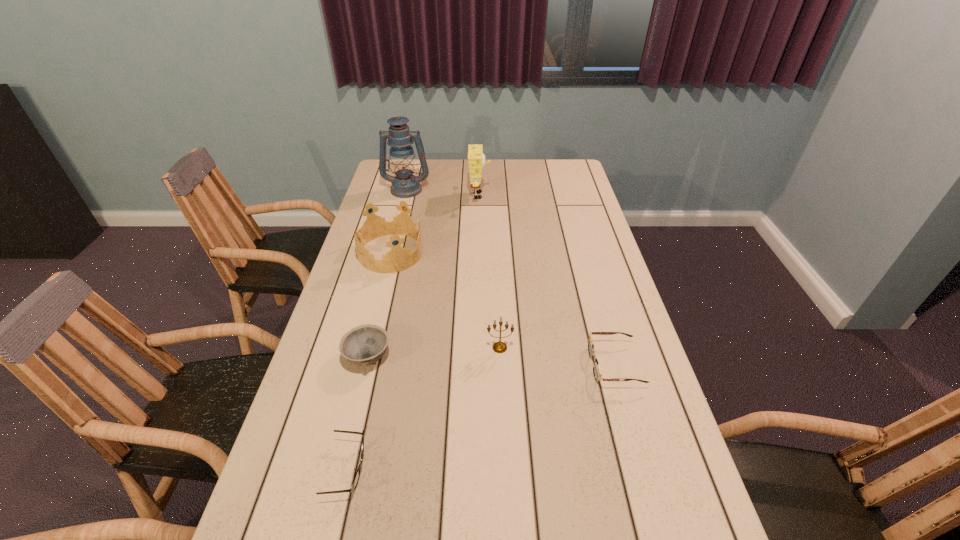
The width and height of the screenshot is (960, 540). Find the location of `object that stands as the sixth closest to the second tallest object`. object that stands as the sixth closest to the second tallest object is located at coordinates (356, 479).

The image size is (960, 540). I want to click on vacant space that satisfies the following two spatial constraints: 1. on the front-facing side of the tiara; 2. on the back side of the candelabrum, so click(x=367, y=348).

What are the coordinates of `free space that satisfies the following two spatial constraints: 1. on the front-facing side of the third shortest object; 2. on the right side of the tiara` in the screenshot? It's located at (364, 357).

Where is `free spot that satisfies the following two spatial constraints: 1. on the front-facing side of the bowl; 2. on the right side of the tallest object`? Image resolution: width=960 pixels, height=540 pixels. free spot that satisfies the following two spatial constraints: 1. on the front-facing side of the bowl; 2. on the right side of the tallest object is located at coordinates (365, 357).

Find the location of a particular element. The image size is (960, 540). blank area in the image that satisfies the following two spatial constraints: 1. on the front-facing side of the tallest object; 2. on the right side of the bowl is located at coordinates (365, 357).

Locate an element on the screen. free space that satisfies the following two spatial constraints: 1. on the front-facing side of the sponge; 2. on the front side of the fifth tallest object is located at coordinates (479, 357).

The image size is (960, 540). Find the location of `vacant space that satisfies the following two spatial constraints: 1. on the front-facing side of the sixth shortest object; 2. on the back side of the candelabrum`. vacant space that satisfies the following two spatial constraints: 1. on the front-facing side of the sixth shortest object; 2. on the back side of the candelabrum is located at coordinates (479, 348).